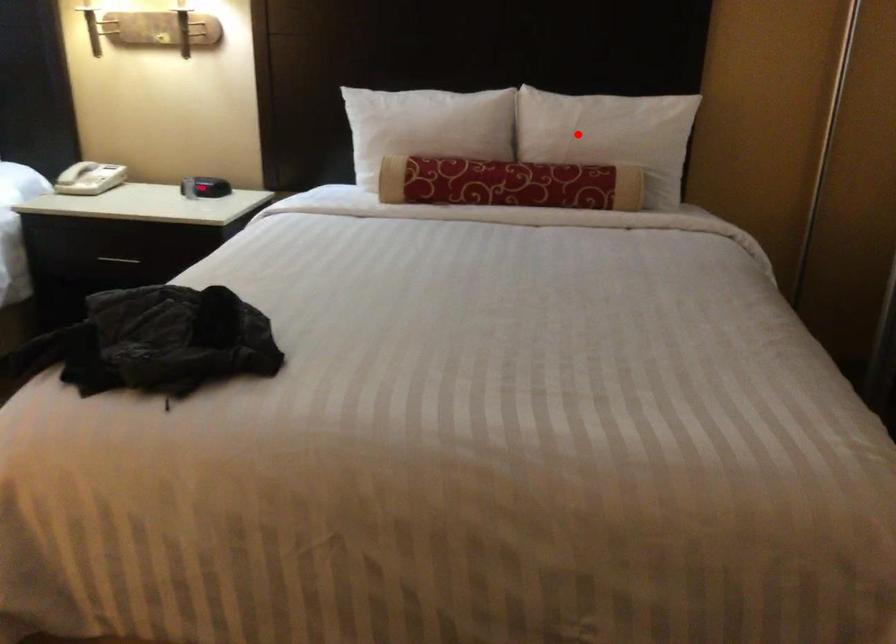
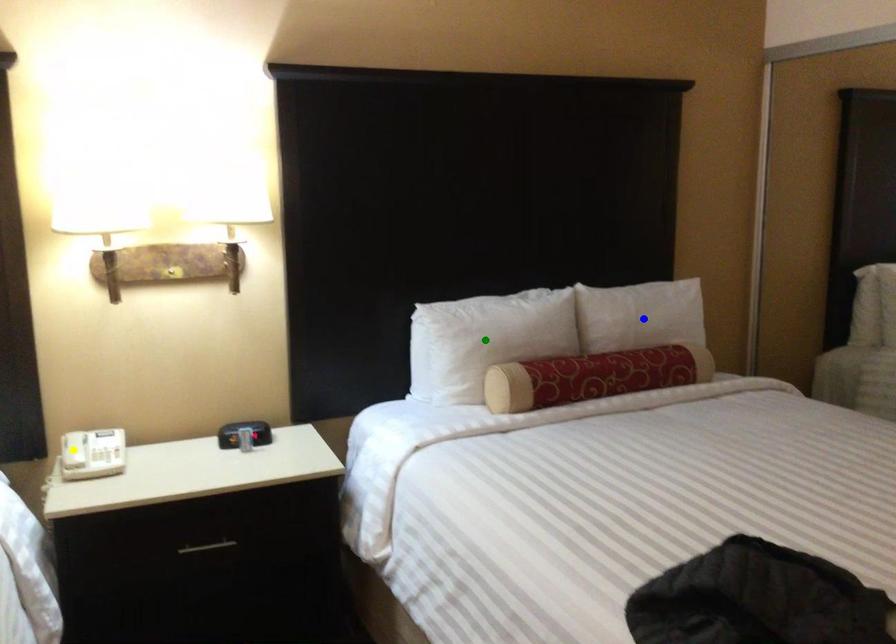
Question: I am providing you with two images of the same scene from different viewpoints. A red point is marked on the first image. You are given multiple points on the second image. In image 2, which mark is for the same physical point as the one in image 1?

Choices:
 (A) blue point
 (B) green point
 (C) yellow point

Answer: (A)